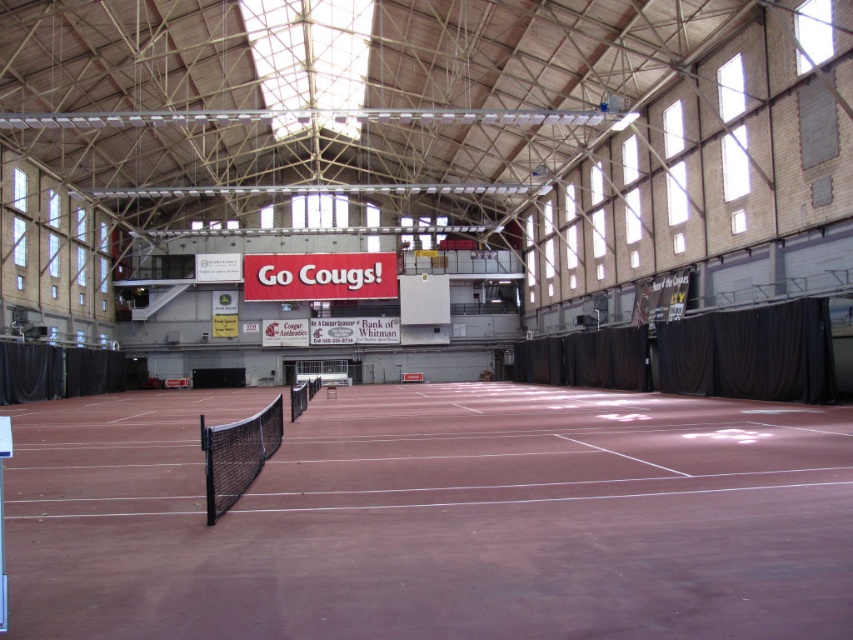
What do you see at coordinates (434, 516) in the screenshot? I see `brown clay tennis court at center` at bounding box center [434, 516].

Is point (531, 621) farther from camera compared to point (213, 428)?

No.

This screenshot has height=640, width=853. Find the location of `brown clay tennis court at center`. brown clay tennis court at center is located at coordinates (434, 516).